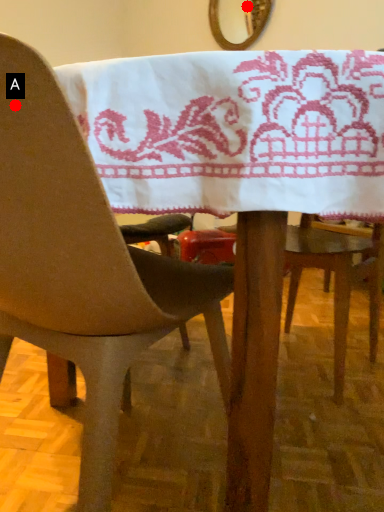
Question: Two points are circled on the image, labeled by A and B beside each circle. Which of the following is the closest to the observer?

Choices:
 (A) A is closer
 (B) B is closer

Answer: (A)